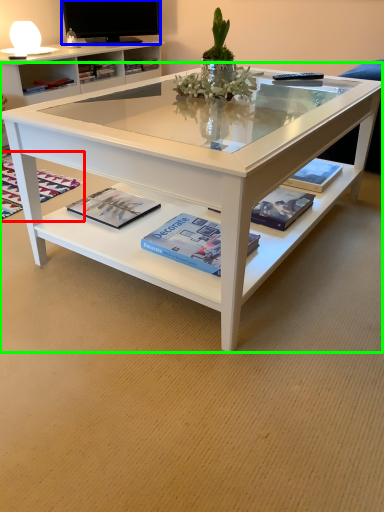
Question: Based on their relative distances, which object is farther from magazine (highlighted by a red box)? Choose from television (highlighted by a blue box) and coffee table (highlighted by a green box).

Choices:
 (A) television
 (B) coffee table

Answer: (A)